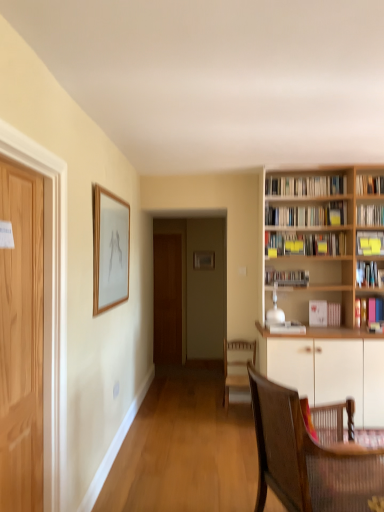
Question: Is white paper book at right, which is the 8th book from top to bottom, closer to the viewer compared to brown woven chair at lower right, the 1th chair viewed from the front?

Choices:
 (A) no
 (B) yes

Answer: (A)

Question: Is white paper book at right, arranged as the second book when ordered from the bottom, thinner than brown woven chair at lower right, the 2th chair from the back?

Choices:
 (A) no
 (B) yes

Answer: (B)

Question: Is white paper book at right, arranged as the second book when ordered from the bottom, wider than brown woven chair at lower right, the 2th chair from the back?

Choices:
 (A) yes
 (B) no

Answer: (B)

Question: Are white paper book at right, which is the 8th book from top to bottom, and brown woven chair at lower right, the 1th chair viewed from the front, beside each other?

Choices:
 (A) yes
 (B) no

Answer: (B)

Question: Would you say brown woven chair at lower right, the 1th chair viewed from the front, is part of white paper book at right, arranged as the second book when ordered from the bottom,'s contents?

Choices:
 (A) yes
 (B) no

Answer: (B)

Question: From a real-world perspective, is matte wooden picture frame at upper left above or below wooden bookcase at right?

Choices:
 (A) below
 (B) above

Answer: (A)

Question: Is matte wooden picture frame at upper left wider or thinner than wooden bookcase at right?

Choices:
 (A) thin
 (B) wide

Answer: (A)

Question: Would you say matte wooden picture frame at upper left is inside or outside wooden bookcase at right?

Choices:
 (A) inside
 (B) outside

Answer: (B)

Question: Is matte wooden picture frame at upper left bigger or smaller than wooden bookcase at right?

Choices:
 (A) big
 (B) small

Answer: (B)

Question: From a real-world perspective, is hardcover book at upper right, which is the 1th book from top to bottom, above or below white paper bookshelf at right, acting as the third book starting from the top?

Choices:
 (A) above
 (B) below

Answer: (A)

Question: Considering the positions of hardcover book at upper right, which is the 1th book from top to bottom, and white paper bookshelf at right, acting as the third book starting from the top, in the image, is hardcover book at upper right, which is the 1th book from top to bottom, bigger or smaller than white paper bookshelf at right, acting as the third book starting from the top,?

Choices:
 (A) big
 (B) small

Answer: (B)

Question: From the image's perspective, is hardcover book at upper right, which is the 1th book from top to bottom, positioned above or below white paper bookshelf at right, the 7th book when ordered from bottom to top?

Choices:
 (A) below
 (B) above

Answer: (B)

Question: Is point (379, 177) positioned closer to the camera than point (380, 203)?

Choices:
 (A) closer
 (B) farther

Answer: (B)

Question: Relative to wooden bookcase at right, is white matte cabinet at right in front or behind?

Choices:
 (A) front
 (B) behind

Answer: (A)

Question: In terms of size, does white matte cabinet at right appear bigger or smaller than wooden bookcase at right?

Choices:
 (A) big
 (B) small

Answer: (A)